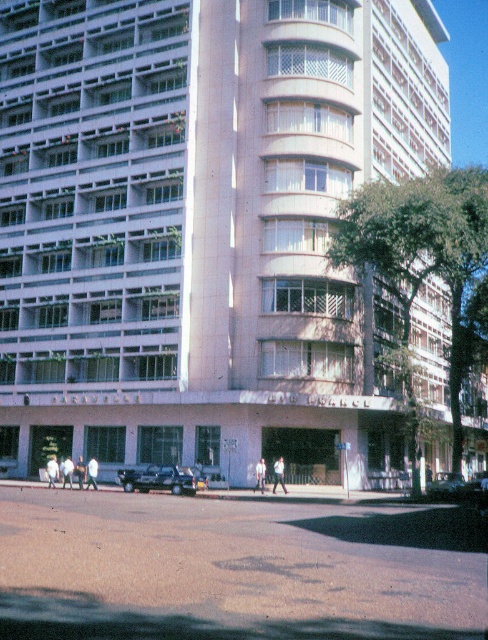
Is point (454, 481) less distant than point (262, 476)?

That is False.

Is shiny silver sedan at center positioned in front of light blue shirt at center?

That is True.

Is point (442, 477) closer to viewer compared to point (263, 461)?

No, (442, 477) is further to viewer.

Locate an element on the screen. shiny silver sedan at center is located at coordinates (446, 484).

Can you confirm if white concrete building at center is shorter than light beige pants at lower left?

In fact, white concrete building at center may be taller than light beige pants at lower left.

Does white concrete building at center appear on the right side of light beige pants at lower left?

Indeed, white concrete building at center is positioned on the right side of light beige pants at lower left.

The image size is (488, 640). I want to click on white concrete building at center, so click(x=200, y=221).

At what (x,y) coordinates should I click in order to perform the action: click on white concrete building at center. Please return your answer as a coordinate pair (x, y). Looking at the image, I should click on click(200, 221).

Is metallic silver truck at center wider than light brown leather jacket at lower left?

Incorrect, metallic silver truck at center's width does not surpass light brown leather jacket at lower left's.

Which is more to the left, metallic silver truck at center or light brown leather jacket at lower left?

light brown leather jacket at lower left

This screenshot has height=640, width=488. Find the location of `metallic silver truck at center`. metallic silver truck at center is located at coordinates (159, 477).

Identify the location of metallic silver truck at center. (159, 477).